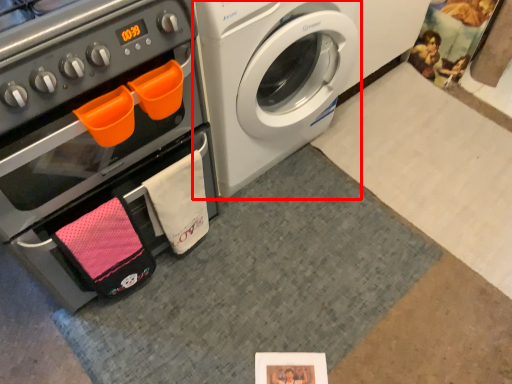
Question: From the image's perspective, what is the correct spatial relationship of washing machine (annotated by the red box) in relation to oven?

Choices:
 (A) above
 (B) below

Answer: (A)